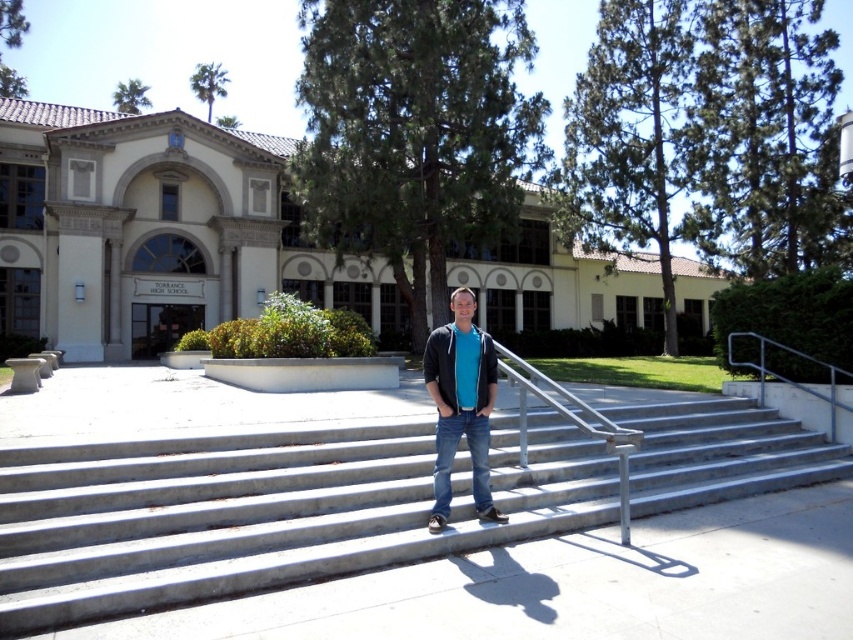
Measure the distance between concrete stairs at center and silver metallic handrail at upper right.

The distance of concrete stairs at center from silver metallic handrail at upper right is 2.83 meters.

You are a GUI agent. You are given a task and a screenshot of the screen. Output one action in this format:
    pyautogui.click(x=<x>, y=<y>)
    Task: Click on the concrete stairs at center
    This screenshot has width=853, height=640.
    Given the screenshot: What is the action you would take?
    pyautogui.click(x=263, y=513)

Which is in front, point (27, 536) or point (782, 346)?

Positioned in front is point (27, 536).

At what (x,y) coordinates should I click in order to perform the action: click on concrete stairs at center. Please return your answer as a coordinate pair (x, y). Image resolution: width=853 pixels, height=640 pixels. Looking at the image, I should click on [x=263, y=513].

Describe the element at coordinates (263, 513) in the screenshot. I see `concrete stairs at center` at that location.

Which of these two, concrete stairs at center or matte blue shirt at center, stands taller?

matte blue shirt at center is taller.

Does point (263, 548) lie behind point (424, 349)?

No.

Identify the location of concrete stairs at center. The width and height of the screenshot is (853, 640). (263, 513).

Looking at this image, is blue denim jeans at center shorter than silver metallic handrail at upper right?

Indeed, blue denim jeans at center has a lesser height compared to silver metallic handrail at upper right.

Between point (433, 467) and point (850, 376), which one is positioned behind?

The point (850, 376) is behind.

Locate an element on the screen. The width and height of the screenshot is (853, 640). blue denim jeans at center is located at coordinates (453, 456).